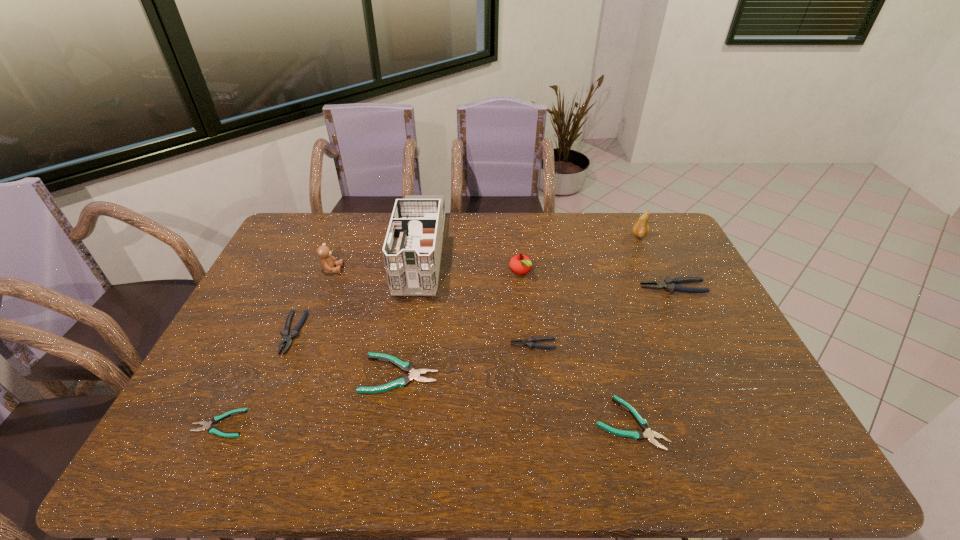
In order to click on vacant area situated on the front of the red apple in this screenshot , I will do `click(528, 345)`.

The image size is (960, 540). I want to click on free space located 0.340m at the gripping part of the farthest gray pliers, so click(x=535, y=288).

This screenshot has height=540, width=960. In order to click on vacant area situated 0.200m at the gripping part of the farthest gray pliers in this screenshot , I will do `click(578, 288)`.

This screenshot has width=960, height=540. I want to click on free space located 0.380m at the gripping part of the farthest gray pliers, so click(x=522, y=288).

The width and height of the screenshot is (960, 540). Find the location of `vacant region located at the gripping part of the fifth shortest pliers`. vacant region located at the gripping part of the fifth shortest pliers is located at coordinates (262, 404).

You are a GUI agent. You are given a task and a screenshot of the screen. Output one action in this format:
    pyautogui.click(x=<x>, y=<y>)
    Task: Click on the vacant space located 0.140m at the gripping part of the fourth pliers from left to right
    The height and width of the screenshot is (540, 960).
    Given the screenshot: What is the action you would take?
    pos(461,345)

Image resolution: width=960 pixels, height=540 pixels. In order to click on vacant space located 0.330m at the gripping part of the fourth pliers from left to right in this screenshot , I will do [394, 345].

Find the location of a particular element. The width and height of the screenshot is (960, 540). vacant position located at the gripping part of the fourth pliers from left to right is located at coordinates (419, 345).

This screenshot has height=540, width=960. I want to click on vacant space located on the back of the third pliers from left to right, so click(x=406, y=336).

Where is `vacant space located on the back of the fifth tallest pliers`? vacant space located on the back of the fifth tallest pliers is located at coordinates (616, 377).